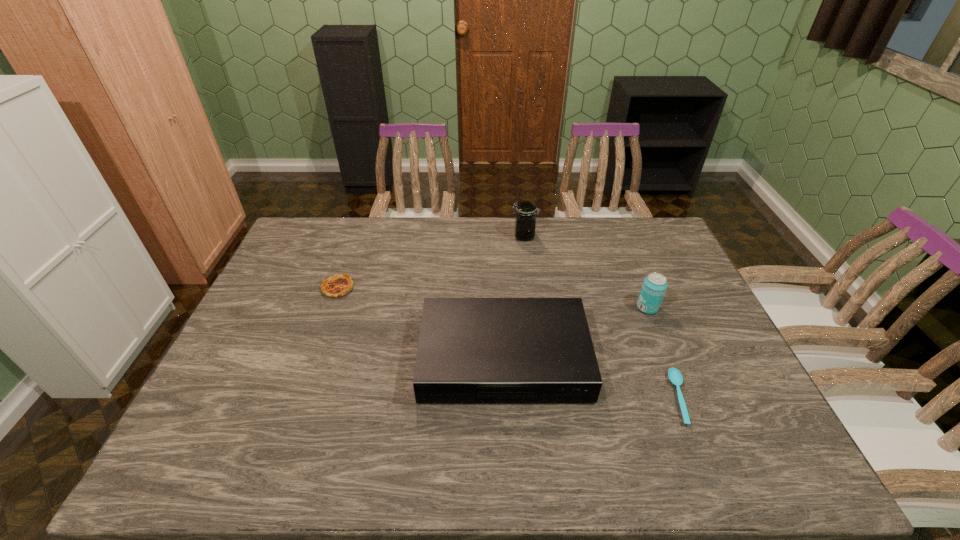
Where is `free space at the near left corner of the desktop`? This screenshot has width=960, height=540. free space at the near left corner of the desktop is located at coordinates (247, 440).

I want to click on empty location between the jar and the second farthest object, so click(x=431, y=262).

Find the location of `free point between the beer can and the shortest object`. free point between the beer can and the shortest object is located at coordinates (663, 353).

Find the location of a particular element. The width and height of the screenshot is (960, 540). empty space that is in between the jar and the spoon is located at coordinates (602, 317).

Find the location of a particular element. The width and height of the screenshot is (960, 540). blank region between the farthest object and the spoon is located at coordinates (602, 317).

What are the coordinates of `blank region between the third nearest object and the second shortest object` in the screenshot? It's located at (492, 298).

Locate an element on the screen. The width and height of the screenshot is (960, 540). free area in between the jar and the spoon is located at coordinates (602, 317).

I want to click on free spot between the CD player and the fourth nearest object, so click(420, 323).

You are a GUI agent. You are given a task and a screenshot of the screen. Output one action in this format:
    pyautogui.click(x=<x>, y=<y>)
    Task: Click on the blank region between the farthest object and the second farthest object
    
    Given the screenshot: What is the action you would take?
    pyautogui.click(x=431, y=262)

Identify the location of empty space that is in between the third tallest object and the jar. The image size is (960, 540). (514, 298).